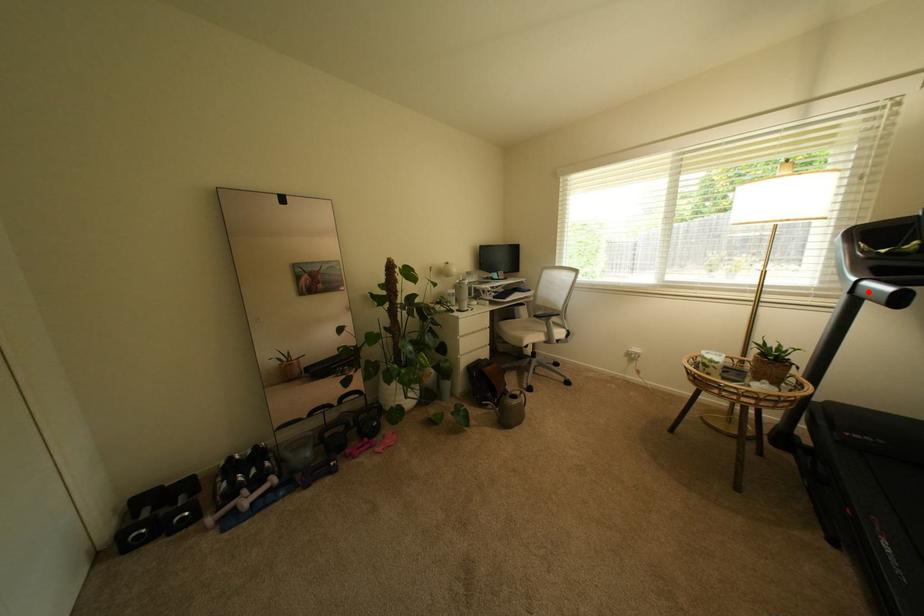
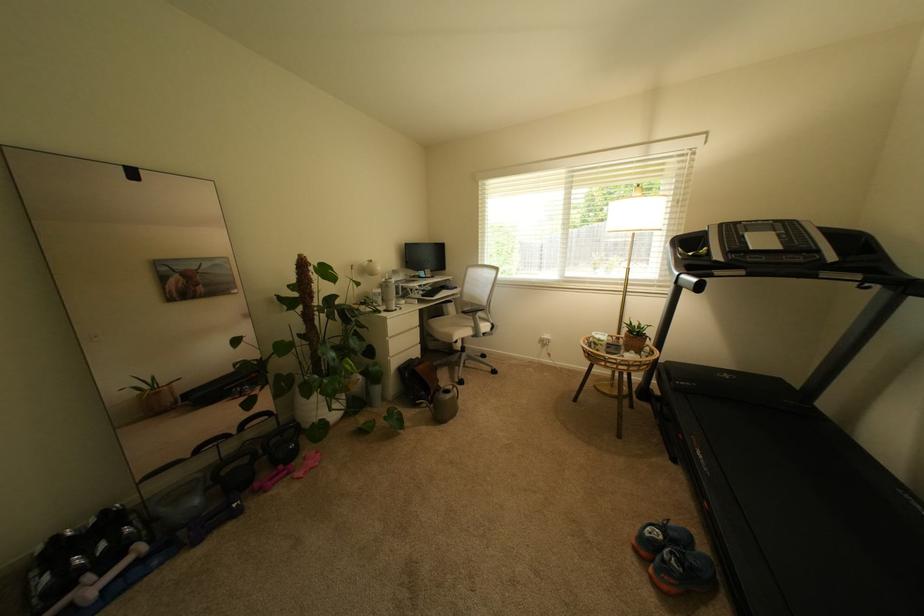
Question: I am providing you with two images of the same scene from different viewpoints. A red point is shown in image1. For the corresponding object point in image2, is it positioned nearer or farther from the camera?

Choices:
 (A) Nearer
 (B) Farther

Answer: (A)